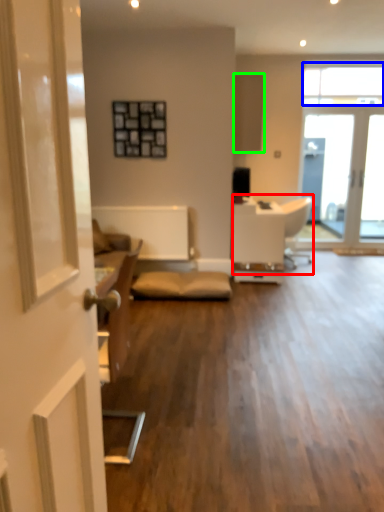
Question: Based on their relative distances, which object is farther from armchair (highlighted by a red box)? Choose from window (highlighted by a blue box) and cabinetry (highlighted by a green box).

Choices:
 (A) window
 (B) cabinetry

Answer: (A)